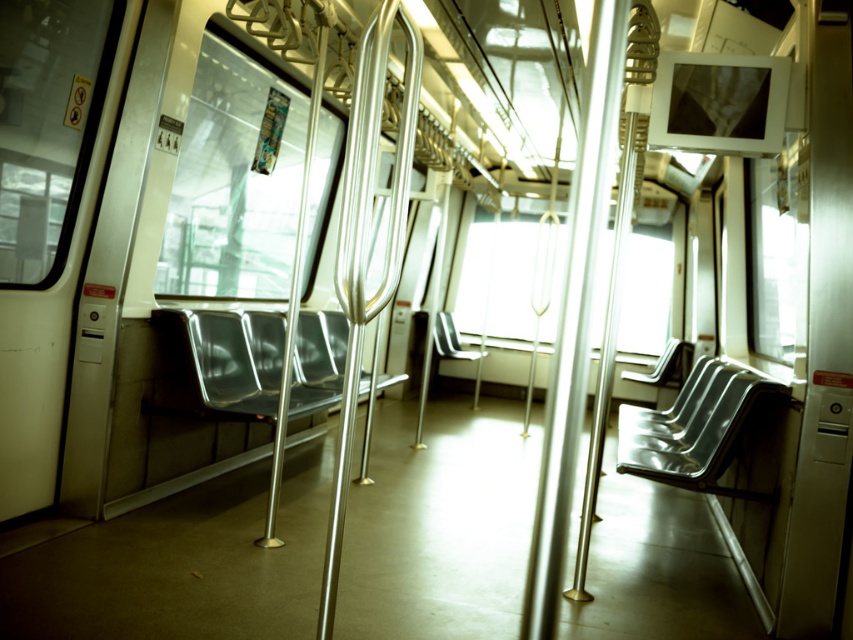
Is point (436, 344) positioned after point (662, 364)?

Yes, point (436, 344) is behind point (662, 364).

Who is higher up, metallic silver chair at center or metallic silver seat at center?

metallic silver chair at center

Which is behind, point (456, 349) or point (653, 380)?

Point (456, 349)

You are a GUI agent. You are given a task and a screenshot of the screen. Output one action in this format:
    pyautogui.click(x=<x>, y=<y>)
    Task: Click on the metallic silver chair at center
    The height and width of the screenshot is (640, 853).
    Given the screenshot: What is the action you would take?
    pyautogui.click(x=454, y=346)

Which is more to the right, polished metal handrail at center or metallic silver seat at center?

metallic silver seat at center is more to the right.

In the scene shown: Which is above, polished metal handrail at center or metallic silver seat at center?

polished metal handrail at center is higher up.

Where is `polished metal handrail at center`? The image size is (853, 640). polished metal handrail at center is located at coordinates click(x=366, y=243).

Is polished metal handrail at center shorter than metallic silver seat at right?

Incorrect, polished metal handrail at center's height does not fall short of metallic silver seat at right's.

Which is below, polished metal handrail at center or metallic silver seat at right?

Positioned lower is metallic silver seat at right.

This screenshot has height=640, width=853. What do you see at coordinates (366, 243) in the screenshot? I see `polished metal handrail at center` at bounding box center [366, 243].

Where is `polished metal handrail at center`? This screenshot has height=640, width=853. polished metal handrail at center is located at coordinates (366, 243).